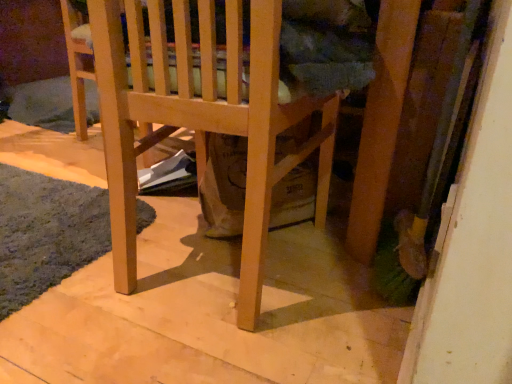
Question: Does point (134, 269) appear closer or farther from the camera than point (2, 180)?

Choices:
 (A) closer
 (B) farther

Answer: (A)

Question: Would you say natural wood chair at center is to the left or to the right of soft gray carpet at lower left in the picture?

Choices:
 (A) right
 (B) left

Answer: (A)

Question: In the image, is natural wood chair at center positioned in front of or behind soft gray carpet at lower left?

Choices:
 (A) front
 (B) behind

Answer: (A)

Question: Looking at their shapes, would you say soft gray carpet at lower left is wider or thinner than natural wood chair at center?

Choices:
 (A) thin
 (B) wide

Answer: (A)

Question: Looking at the image, does soft gray carpet at lower left seem bigger or smaller compared to natural wood chair at center?

Choices:
 (A) small
 (B) big

Answer: (A)

Question: Is point (36, 284) closer or farther from the camera than point (130, 175)?

Choices:
 (A) closer
 (B) farther

Answer: (B)

Question: Is soft gray carpet at lower left inside the boundaries of natural wood chair at center, or outside?

Choices:
 (A) outside
 (B) inside

Answer: (A)